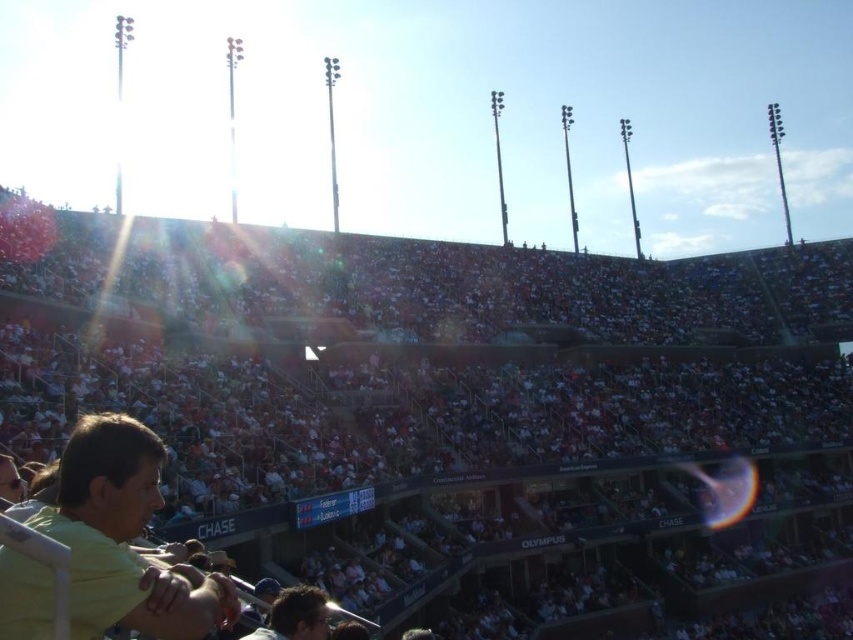
You are a photographer trying to capture a clear shot of both the yellow matte shirt at lower left and the dark brown hair at lower center. Given the glare from the sun, which object might be more obscured in your photo?

The yellow matte shirt at lower left is much taller than the dark brown hair at lower center, so it might be more obscured by the glare since it is taller and positioned in the area affected by the lens flare.

You are a photographer trying to capture a clear shot of the yellow matte shirt at lower left and the dark brown hair at lower center. Since the sun is causing glare in the lower part of the image, which object might be easier to see in the photo?

The yellow matte shirt at lower left is bigger than the dark brown hair at lower center, so it might be easier to see despite the glare because its larger size makes it more visible.